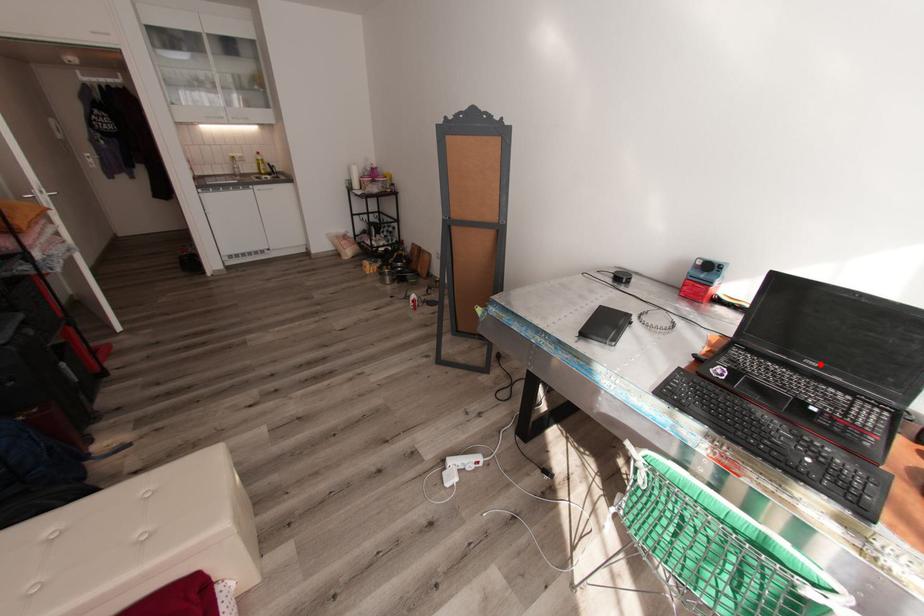
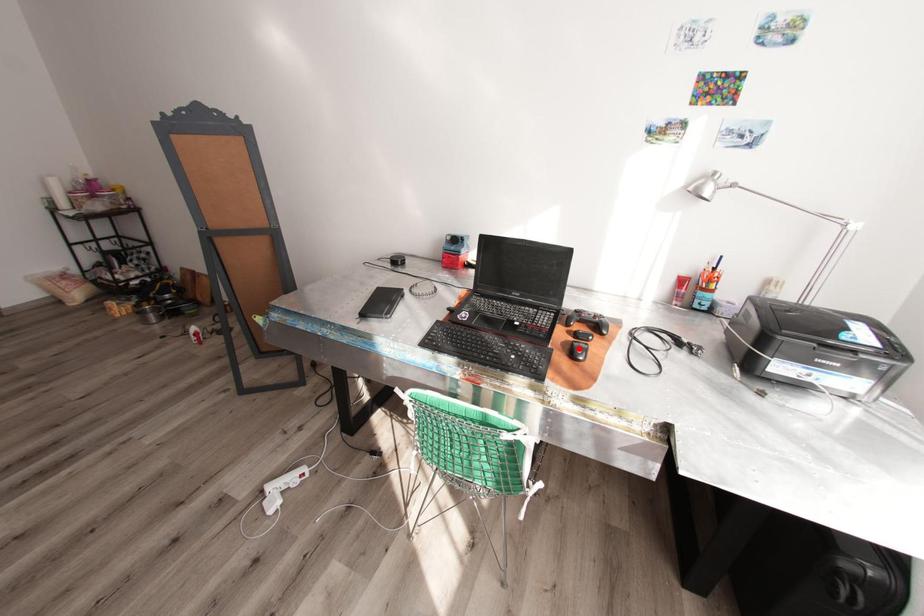
I am providing you with two images of the same scene from different viewpoints. A red point is marked on the first image and another point is marked on the second image. Do the highlighted points in image1 and image2 indicate the same real-world spot?

No